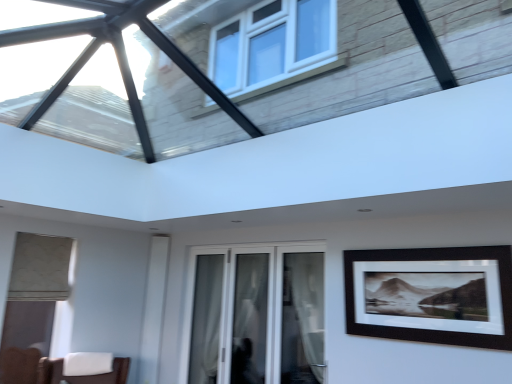
Question: Can you confirm if white sheer curtain at center, which is counted as the 2th curtain, starting from the right, is positioned to the right of white sheer curtain at center, the second curtain in the left-to-right sequence?

Choices:
 (A) no
 (B) yes

Answer: (A)

Question: From a real-world perspective, is white sheer curtain at center, which is counted as the 2th curtain, starting from the right, on top of white sheer curtain at center, which appears as the first curtain when viewed from the front?

Choices:
 (A) no
 (B) yes

Answer: (A)

Question: Does white sheer curtain at center, positioned as the second curtain in front-to-back order, have a lesser width compared to white sheer curtain at center, which appears as the first curtain when viewed from the front?

Choices:
 (A) yes
 (B) no

Answer: (A)

Question: Considering the relative positions of white sheer curtain at center, positioned as the second curtain in front-to-back order, and white sheer curtain at center, the second curtain in the left-to-right sequence, in the image provided, is white sheer curtain at center, positioned as the second curtain in front-to-back order, to the left of white sheer curtain at center, the second curtain in the left-to-right sequence, from the viewer's perspective?

Choices:
 (A) no
 (B) yes

Answer: (B)

Question: Considering the relative sizes of white sheer curtain at center, which is the first curtain from back to front, and white sheer curtain at center, the second curtain in the left-to-right sequence, in the image provided, is white sheer curtain at center, which is the first curtain from back to front, bigger than white sheer curtain at center, the second curtain in the left-to-right sequence,?

Choices:
 (A) no
 (B) yes

Answer: (A)

Question: Is black matte picture frame at right taller or shorter than white glass door at center?

Choices:
 (A) short
 (B) tall

Answer: (A)

Question: From the image's perspective, is black matte picture frame at right above or below white glass door at center?

Choices:
 (A) above
 (B) below

Answer: (A)

Question: In terms of size, does black matte picture frame at right appear bigger or smaller than white glass door at center?

Choices:
 (A) big
 (B) small

Answer: (B)

Question: Which is correct: black matte picture frame at right is inside white glass door at center, or outside of it?

Choices:
 (A) outside
 (B) inside

Answer: (A)

Question: From the image's perspective, relative to white sheer curtain at center, positioned as the second curtain in back-to-front order, is white sheer curtain at center, which is the first curtain from back to front, above or below?

Choices:
 (A) above
 (B) below

Answer: (B)

Question: Considering their positions, is white sheer curtain at center, which is the first curtain from back to front, located in front of or behind white sheer curtain at center, positioned as the second curtain in back-to-front order?

Choices:
 (A) front
 (B) behind

Answer: (B)

Question: Considering the positions of white sheer curtain at center, which is counted as the 2th curtain, starting from the right, and white sheer curtain at center, the second curtain in the left-to-right sequence, in the image, is white sheer curtain at center, which is counted as the 2th curtain, starting from the right, taller or shorter than white sheer curtain at center, the second curtain in the left-to-right sequence,?

Choices:
 (A) short
 (B) tall

Answer: (B)

Question: Would you say white sheer curtain at center, which is counted as the 2th curtain, starting from the right, is to the left or to the right of white sheer curtain at center, which appears as the first curtain when viewed from the front, in the picture?

Choices:
 (A) right
 (B) left

Answer: (B)

Question: Is black matte picture frame at right taller or shorter than white sheer curtain at center, positioned as the second curtain in front-to-back order?

Choices:
 (A) short
 (B) tall

Answer: (A)

Question: Is point (480, 299) positioned closer to the camera than point (209, 380)?

Choices:
 (A) farther
 (B) closer

Answer: (B)